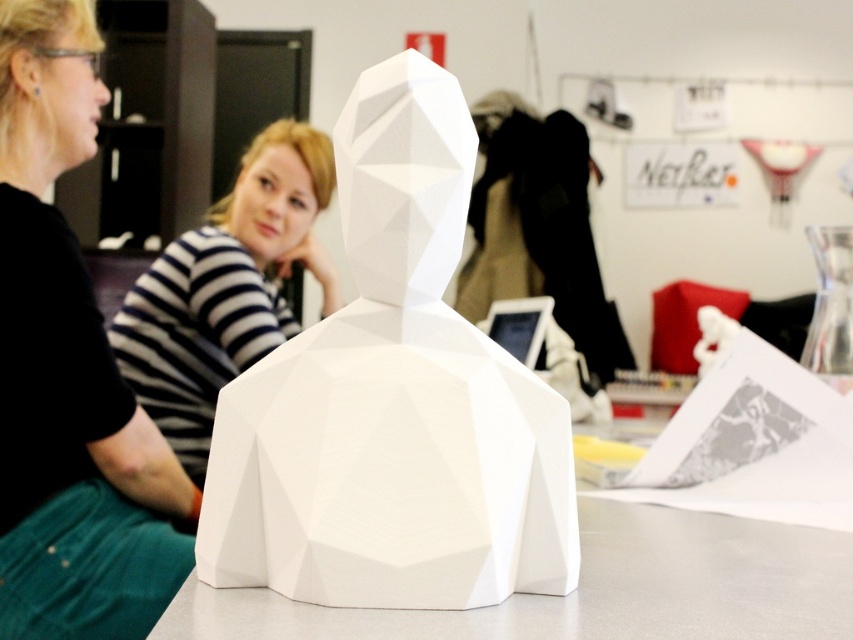
This screenshot has height=640, width=853. What do you see at coordinates (593, 589) in the screenshot?
I see `white matte table at center` at bounding box center [593, 589].

Consider the image. Can you confirm if white matte table at center is shorter than striped shirt at center?

Indeed, white matte table at center has a lesser height compared to striped shirt at center.

Which is behind, point (316, 620) or point (233, 317)?

The point (233, 317) is more distant.

Identify the location of white matte table at center. pos(593,589).

Is point (26, 371) in front of point (184, 321)?

Yes, it is in front of point (184, 321).

Is black matte shirt at center to the left of striped shirt at center from the viewer's perspective?

Correct, you'll find black matte shirt at center to the left of striped shirt at center.

Locate an element on the screen. This screenshot has width=853, height=640. black matte shirt at center is located at coordinates click(x=68, y=372).

At what (x,y) coordinates should I click in order to perform the action: click on black matte shirt at center. Please return your answer as a coordinate pair (x, y). The width and height of the screenshot is (853, 640). Looking at the image, I should click on 68,372.

Which is more to the right, black matte shirt at center or white matte table at center?

white matte table at center

Can you confirm if black matte shirt at center is positioned below white matte table at center?

No.

Where is `black matte shirt at center`? black matte shirt at center is located at coordinates (68, 372).